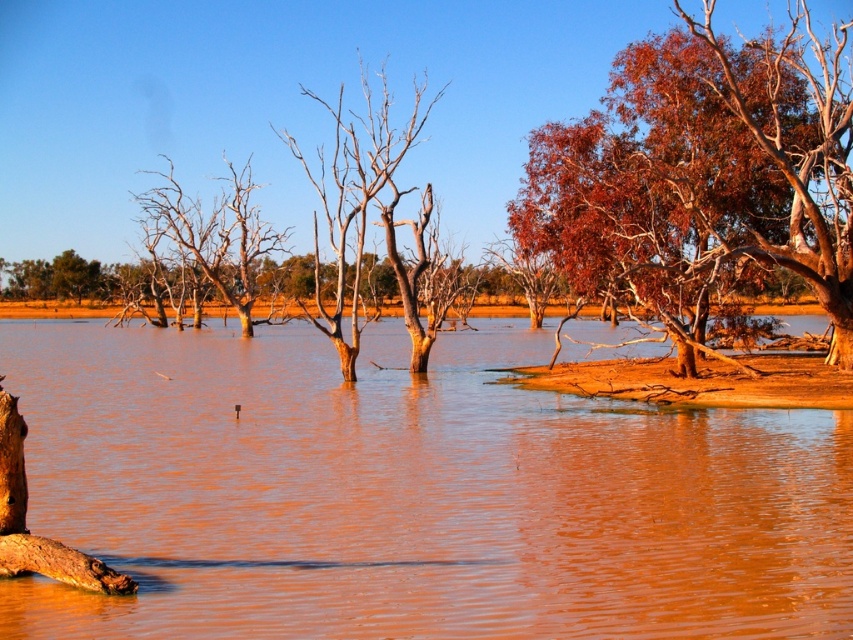
Is point (355, 202) closer to camera compared to point (166, 196)?

That is True.

Between point (352, 269) and point (223, 204), which one is positioned behind?

Point (223, 204)

Where is `smooth bark tree at center`? This screenshot has width=853, height=640. smooth bark tree at center is located at coordinates (364, 211).

Between brown muddy water at center and reddish-brown bark tree at upper right, which one has less height?

brown muddy water at center

Find the location of a particular element. Image resolution: width=853 pixels, height=640 pixels. brown muddy water at center is located at coordinates (410, 493).

Which is more to the left, reddish-brown bark tree at upper right or brown bark tree at left?

brown bark tree at left is more to the left.

Find the location of `reddish-brown bark tree at upper right`. reddish-brown bark tree at upper right is located at coordinates (705, 168).